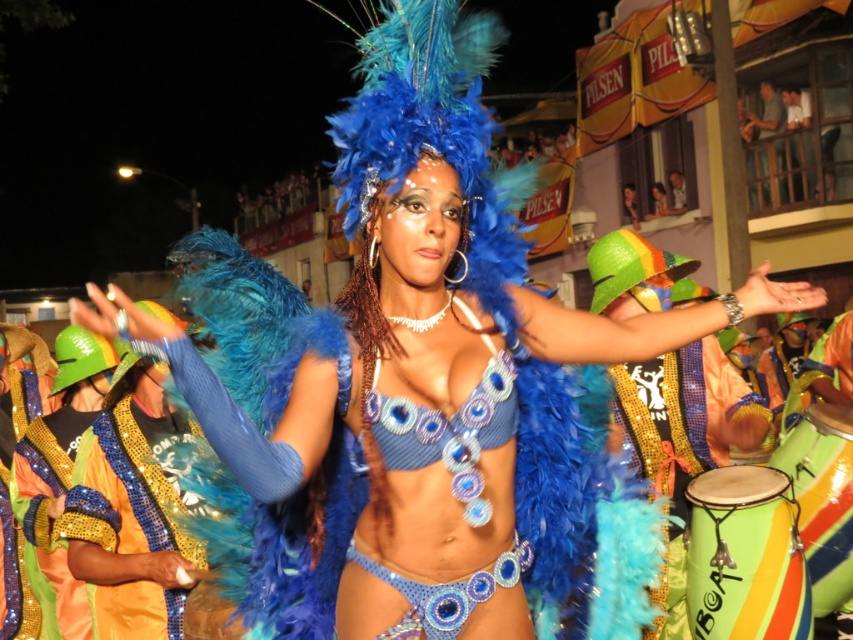
Question: Can you confirm if green painted wood drum at lower right is positioned below green striped drum at lower right?

Choices:
 (A) yes
 (B) no

Answer: (A)

Question: Among these objects, which one is farthest from the camera?

Choices:
 (A) green striped drum at lower right
 (B) shiny gold sequins at center

Answer: (A)

Question: Is shiny gold sequins at center closer to camera compared to green painted wood drum at lower right?

Choices:
 (A) yes
 (B) no

Answer: (B)

Question: Can you confirm if shiny gold sequins at center is positioned to the right of green painted wood drum at lower right?

Choices:
 (A) no
 (B) yes

Answer: (A)

Question: Which point appears closest to the camera in this image?

Choices:
 (A) (142, 600)
 (B) (735, 500)
 (C) (810, 508)

Answer: (B)

Question: Which object is closer to the camera taking this photo?

Choices:
 (A) green painted wood drum at lower right
 (B) green striped drum at lower right

Answer: (A)